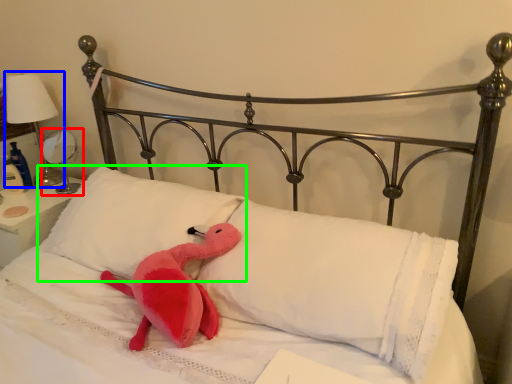
Question: Based on their relative distances, which object is nearer to table lamp (highlighted by a red box)? Choose from table lamp (highlighted by a blue box) and pillow (highlighted by a green box).

Choices:
 (A) table lamp
 (B) pillow

Answer: (A)